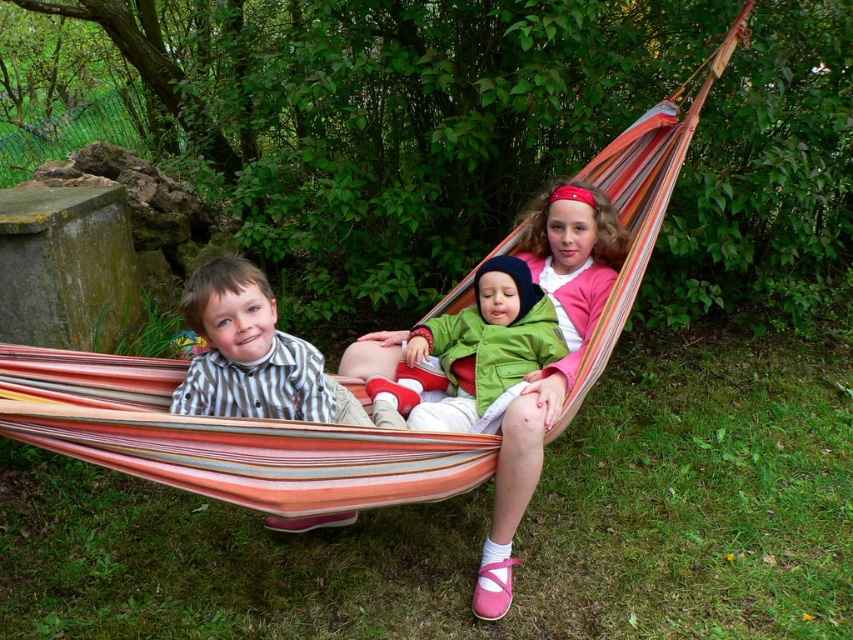
Question: Which point is closer to the camera?

Choices:
 (A) green matte jacket at center
 (B) striped cotton shirt at center
 (C) pink fabric at center
 (D) striped fabric hammock at center

Answer: (D)

Question: Is striped fabric hammock at center to the left of pink fabric at center from the viewer's perspective?

Choices:
 (A) yes
 (B) no

Answer: (A)

Question: Does striped fabric hammock at center have a larger size compared to pink fabric at center?

Choices:
 (A) no
 (B) yes

Answer: (B)

Question: Among these objects, which one is nearest to the camera?

Choices:
 (A) pink fabric at center
 (B) striped cotton shirt at center
 (C) striped fabric hammock at center
 (D) green matte jacket at center

Answer: (C)

Question: Considering the real-world distances, which object is closest to the green matte jacket at center?

Choices:
 (A) pink fabric at center
 (B) striped fabric hammock at center
 (C) striped cotton shirt at center

Answer: (A)

Question: Observing the image, what is the correct spatial positioning of pink fabric at center in reference to green matte jacket at center?

Choices:
 (A) above
 (B) below

Answer: (B)